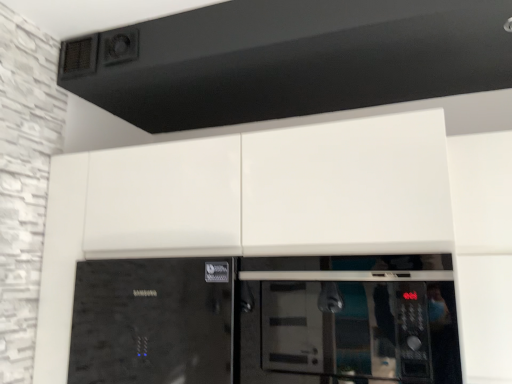
Question: Could you tell me if black textured exhaust hood at upper center is facing glossy white cabinet at center?

Choices:
 (A) no
 (B) yes

Answer: (A)

Question: Is black textured exhaust hood at upper center shorter than glossy white cabinet at center?

Choices:
 (A) no
 (B) yes

Answer: (B)

Question: From a real-world perspective, is black textured exhaust hood at upper center on glossy white cabinet at center?

Choices:
 (A) no
 (B) yes

Answer: (B)

Question: Is black textured exhaust hood at upper center directly adjacent to glossy white cabinet at center?

Choices:
 (A) yes
 (B) no

Answer: (B)

Question: Does black textured exhaust hood at upper center have a larger size compared to glossy white cabinet at center?

Choices:
 (A) no
 (B) yes

Answer: (A)

Question: In the image, is glossy white cabinet at center positioned in front of or behind black textured exhaust hood at upper center?

Choices:
 (A) front
 (B) behind

Answer: (A)

Question: Does point (406, 112) appear closer or farther from the camera than point (247, 46)?

Choices:
 (A) farther
 (B) closer

Answer: (B)

Question: From the image's perspective, relative to black textured exhaust hood at upper center, is glossy white cabinet at center above or below?

Choices:
 (A) above
 (B) below

Answer: (B)

Question: Considering the positions of glossy white cabinet at center and black textured exhaust hood at upper center in the image, is glossy white cabinet at center taller or shorter than black textured exhaust hood at upper center?

Choices:
 (A) short
 (B) tall

Answer: (B)

Question: Is point (281, 301) closer or farther from the camera than point (133, 177)?

Choices:
 (A) farther
 (B) closer

Answer: (B)

Question: From the image's perspective, is black glass microwave at center located above or below glossy white cabinet at center?

Choices:
 (A) above
 (B) below

Answer: (B)

Question: Is black glass microwave at center situated inside glossy white cabinet at center or outside?

Choices:
 (A) inside
 (B) outside

Answer: (A)

Question: From a real-world perspective, is black glass microwave at center above or below glossy white cabinet at center?

Choices:
 (A) below
 (B) above

Answer: (A)

Question: Considering the positions of glossy white cabinet at center and black glass microwave at center in the image, is glossy white cabinet at center taller or shorter than black glass microwave at center?

Choices:
 (A) short
 (B) tall

Answer: (B)

Question: From the image's perspective, is glossy white cabinet at center located above or below black glass microwave at center?

Choices:
 (A) above
 (B) below

Answer: (A)